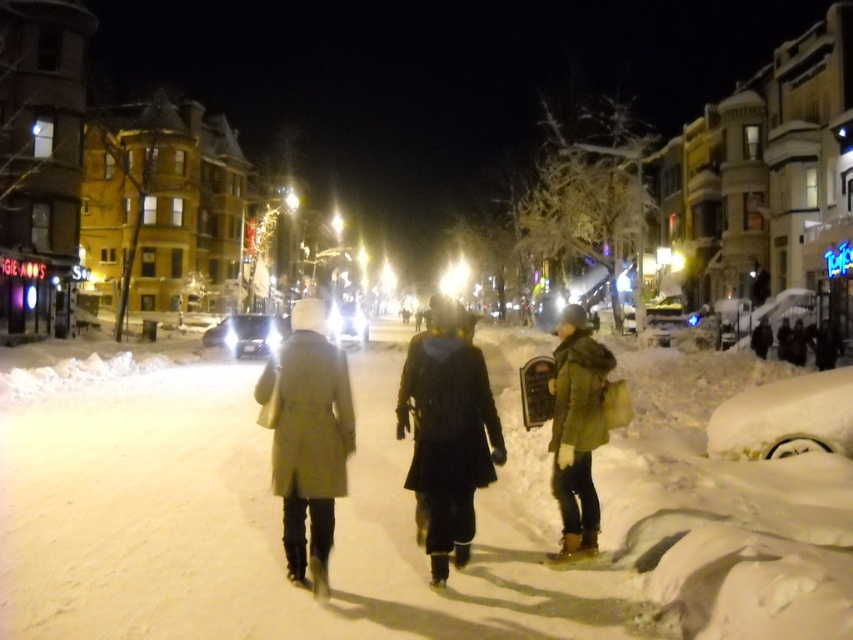
You are a photographer trying to capture both the light beige coat at center and the green matte coat at center in a single frame. Considering their sizes, which coat would require you to step back more to include its entirety in the photo?

The light beige coat at center is wider than the green matte coat at center, so you would need to step back more to capture the light beige coat at center in its entirety.

You are a photographer trying to capture a photo of both the black matte coat at center and the light beige coat at center in the snowy scene. Since you want both coats to appear equally prominent in the photo, which coat should you move closer to the camera?

The black matte coat at center has a larger size compared to light beige coat at center. To make both coats appear equally prominent in the photo, you should move the light beige coat at center closer to the camera since it is smaller and needs to be magnified to match the size of the larger black matte coat at center.